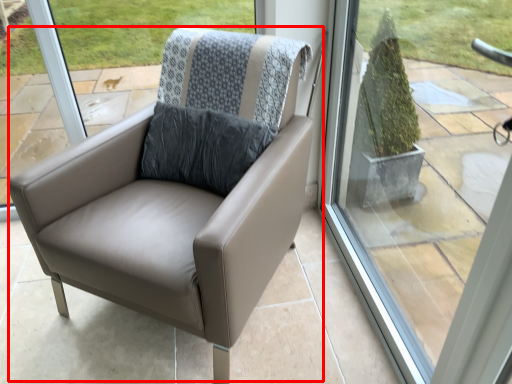
Question: From the image's perspective, what is the correct spatial relationship of chair (annotated by the red box) in relation to window?

Choices:
 (A) above
 (B) below

Answer: (A)